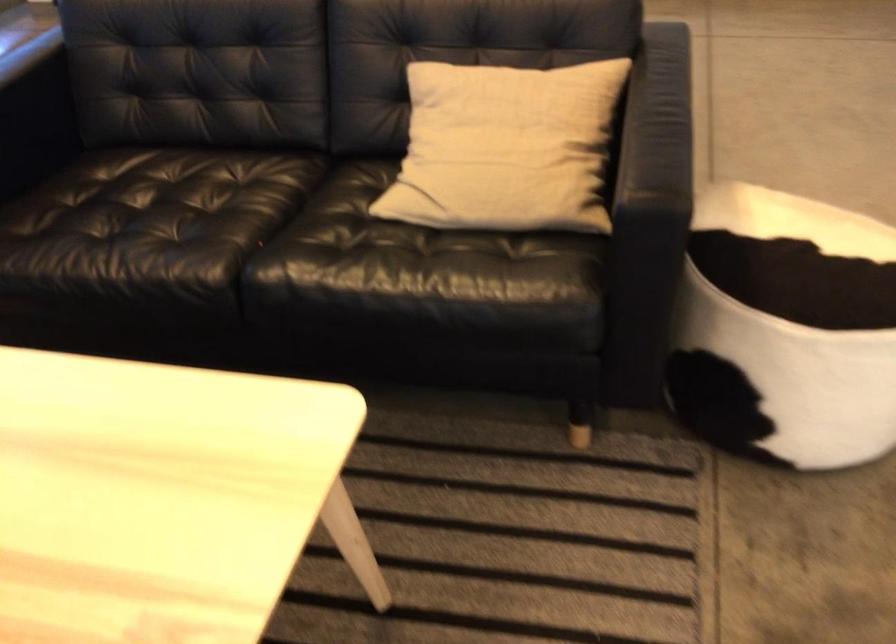
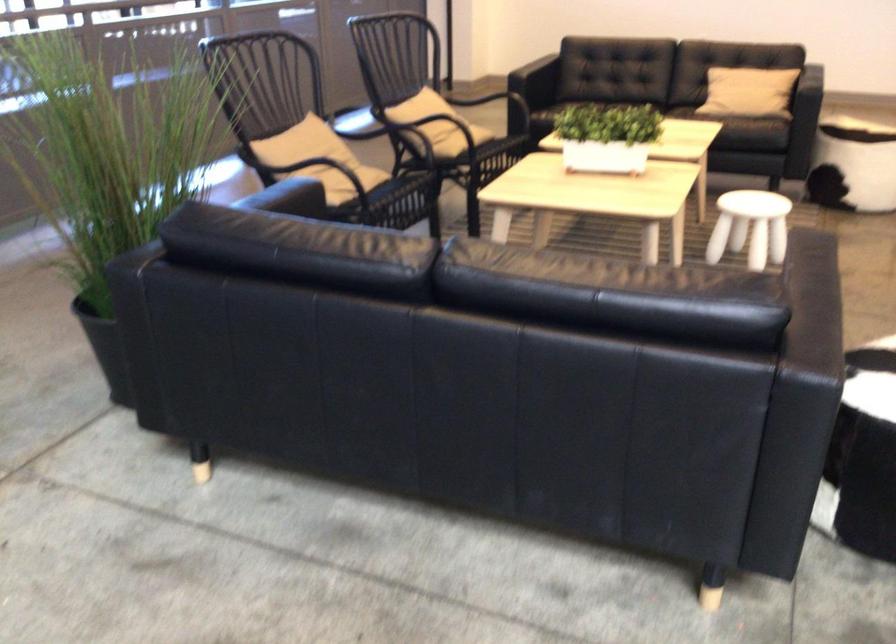
Locate, in the second image, the point that corresponds to point 408,328 in the first image.

(745, 120)